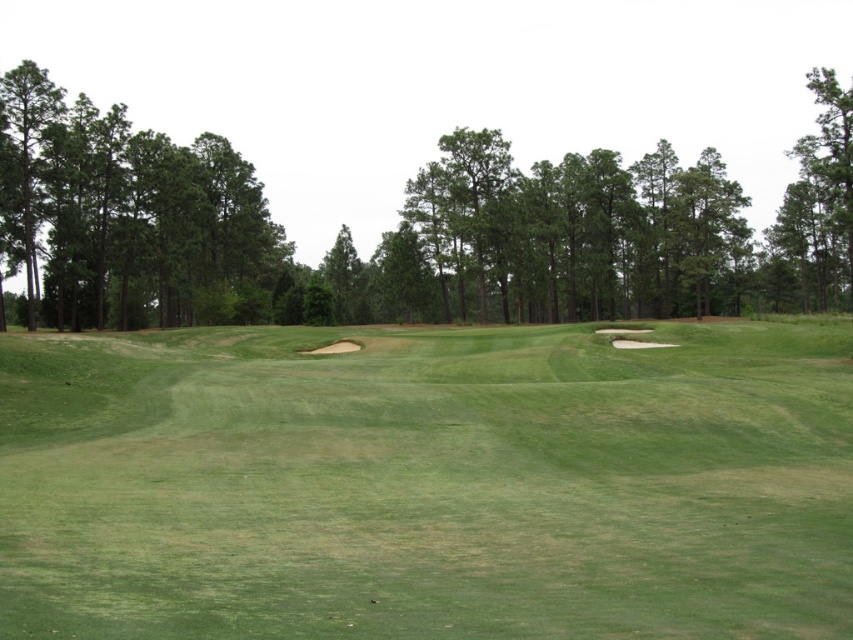
Question: Which point is closer to the camera?

Choices:
 (A) green leafy trees at left
 (B) green leafy trees at center

Answer: (B)

Question: Which object appears closest to the camera in this image?

Choices:
 (A) green leafy trees at left
 (B) green leafy trees at center
 (C) green grassy fairway at center

Answer: (C)

Question: Can you confirm if green grassy fairway at center is positioned above green leafy trees at center?

Choices:
 (A) yes
 (B) no

Answer: (B)

Question: Considering the relative positions of green leafy trees at center and green leafy trees at left in the image provided, where is green leafy trees at center located with respect to green leafy trees at left?

Choices:
 (A) below
 (B) above

Answer: (B)

Question: Which object is farther from the camera taking this photo?

Choices:
 (A) green grassy fairway at center
 (B) green leafy trees at left
 (C) green leafy trees at center

Answer: (B)

Question: Is green leafy trees at center bigger than green leafy trees at left?

Choices:
 (A) no
 (B) yes

Answer: (B)